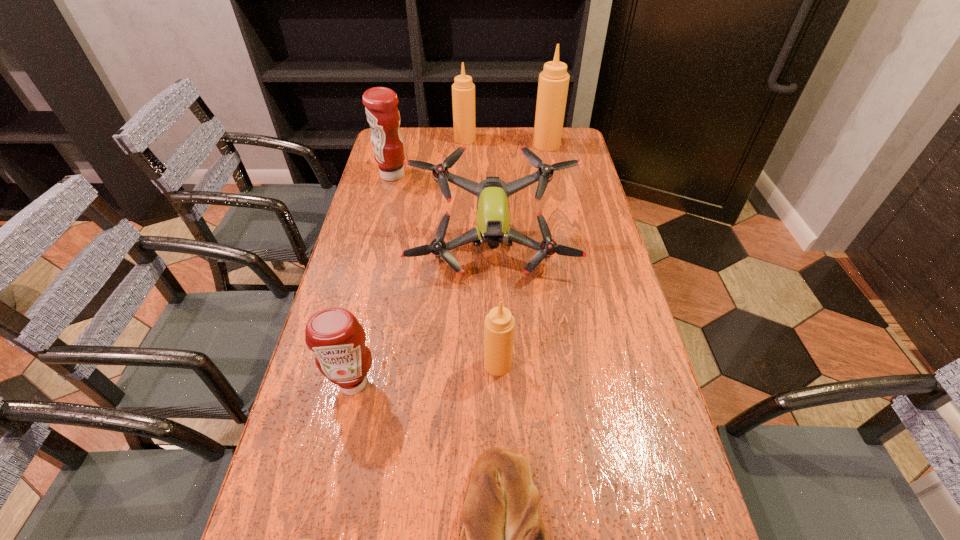
The width and height of the screenshot is (960, 540). Identify the location of condiment that can be found as the second closest to the leftmost tan condiment. (553, 83).

Identify the location of condiment that stands as the third closest to the second condiment from right to left. (553, 83).

Locate an element on the screen. The height and width of the screenshot is (540, 960). the closest tan condiment to the leftmost tan condiment is located at coordinates click(x=553, y=83).

Identify which tan condiment is the nearest to the second smallest tan condiment. Please provide its 2D coordinates. Your answer should be formatted as a tuple, i.e. [(x, y)], where the tuple contains the x and y coordinates of a point satisfying the conditions above.

[(553, 83)]